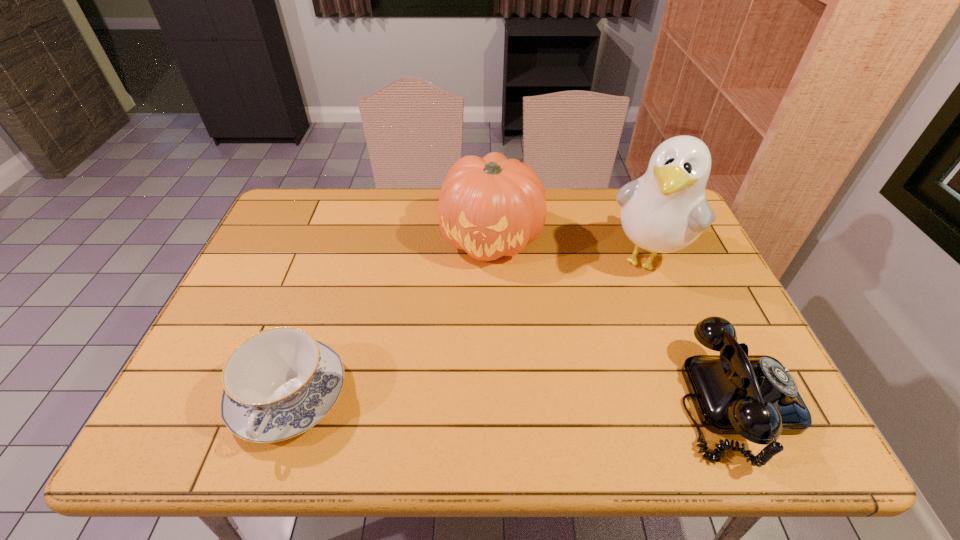
This screenshot has height=540, width=960. I want to click on vacant space on the desktop that is between the leftmost object and the telephone and is positioned on the carved face of the pumpkin, so click(469, 399).

Where is `vacant space on the desktop that is between the shortest object and the second shortest object and is positioned on the beak of the gull`? vacant space on the desktop that is between the shortest object and the second shortest object and is positioned on the beak of the gull is located at coordinates (564, 400).